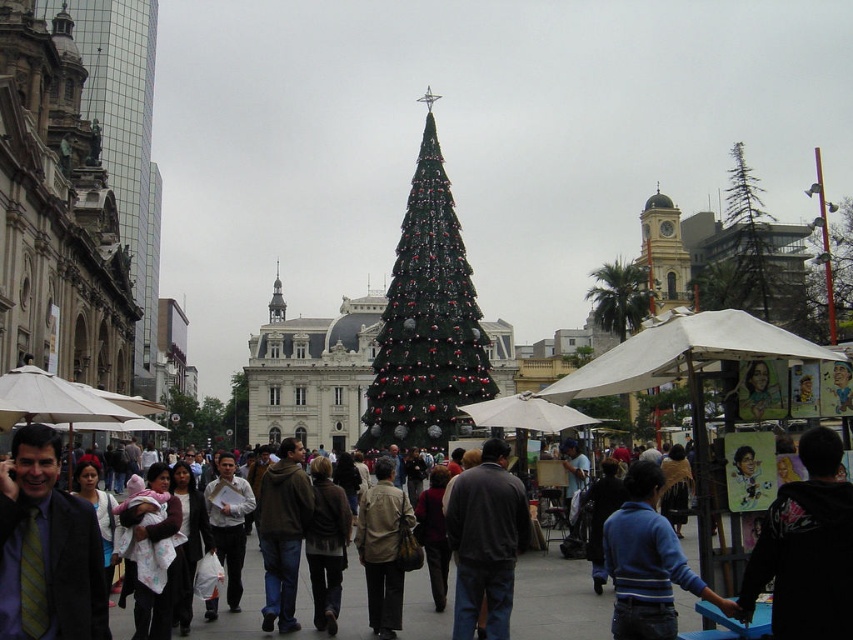
Question: Estimate the real-world distances between objects in this image. Which object is closer to the blue striped sweater at lower right?

Choices:
 (A) green matte christmas tree at center
 (B) dark gray jacket at center

Answer: (B)

Question: Among these objects, which one is farthest from the camera?

Choices:
 (A) blue striped sweater at lower right
 (B) green matte christmas tree at center

Answer: (B)

Question: Is green matte christmas tree at center thinner than blue striped sweater at lower right?

Choices:
 (A) yes
 (B) no

Answer: (B)

Question: Is dark gray jacket at center closer to the viewer compared to blue striped sweater at lower right?

Choices:
 (A) yes
 (B) no

Answer: (A)

Question: Is dark gray jacket at center positioned at the back of blue striped sweater at lower right?

Choices:
 (A) yes
 (B) no

Answer: (B)

Question: Which of the following is the farthest from the observer?

Choices:
 (A) green matte christmas tree at center
 (B) blue striped sweater at lower right
 (C) dark gray jacket at center

Answer: (A)